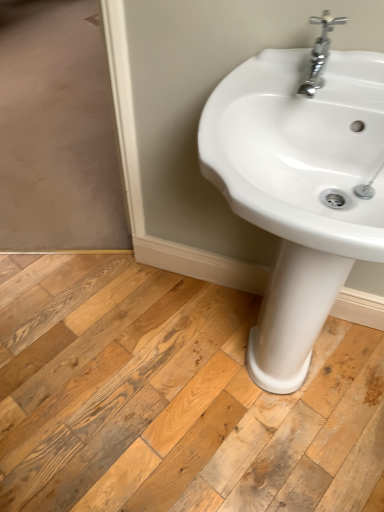
Find the location of a particular element. The width and height of the screenshot is (384, 512). vacant area that is situated to the right of chrome metallic faucet at upper right is located at coordinates (355, 92).